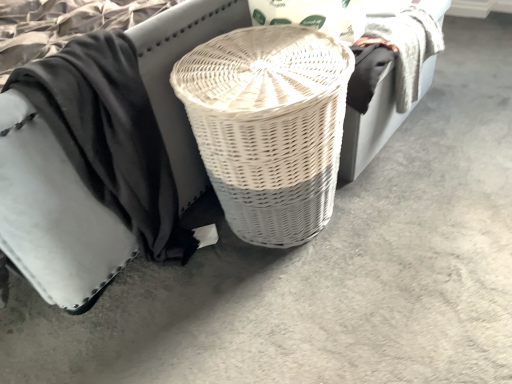
Question: Considering the relative sizes of white wicker basket at center and white wicker basket at center in the image provided, is white wicker basket at center taller than white wicker basket at center?

Choices:
 (A) yes
 (B) no

Answer: (A)

Question: Does white wicker basket at center come in front of white wicker basket at center?

Choices:
 (A) yes
 (B) no

Answer: (A)

Question: Are white wicker basket at center and white wicker basket at center located far from each other?

Choices:
 (A) yes
 (B) no

Answer: (B)

Question: Is white wicker basket at center thinner than white wicker basket at center?

Choices:
 (A) yes
 (B) no

Answer: (B)

Question: Is white wicker basket at center at the left side of white wicker basket at center?

Choices:
 (A) yes
 (B) no

Answer: (A)

Question: Is white wicker basket at center to the right of white wicker basket at center from the viewer's perspective?

Choices:
 (A) no
 (B) yes

Answer: (A)

Question: Does white wicker basket at center have a lesser width compared to white wicker basket at center?

Choices:
 (A) yes
 (B) no

Answer: (A)

Question: Is white wicker basket at center looking in the opposite direction of white wicker basket at center?

Choices:
 (A) yes
 (B) no

Answer: (A)

Question: From a real-world perspective, is white wicker basket at center physically above white wicker basket at center?

Choices:
 (A) no
 (B) yes

Answer: (A)

Question: From a real-world perspective, is white wicker basket at center located beneath white wicker basket at center?

Choices:
 (A) no
 (B) yes

Answer: (B)

Question: Considering the relative sizes of white wicker basket at center and white wicker basket at center in the image provided, is white wicker basket at center shorter than white wicker basket at center?

Choices:
 (A) no
 (B) yes

Answer: (B)

Question: Does white wicker basket at center have a larger size compared to white wicker basket at center?

Choices:
 (A) no
 (B) yes

Answer: (A)

Question: Does white wicker basket at center have a smaller size compared to black cotton cloth at center?

Choices:
 (A) no
 (B) yes

Answer: (B)